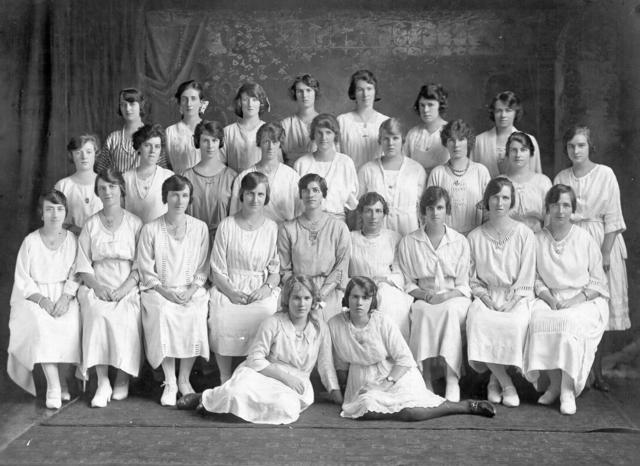
Image resolution: width=640 pixels, height=466 pixels. Identify the location of women sitting on a chair. (566, 272), (489, 265), (428, 260), (374, 257), (317, 252), (246, 252), (175, 251), (114, 252), (41, 265).